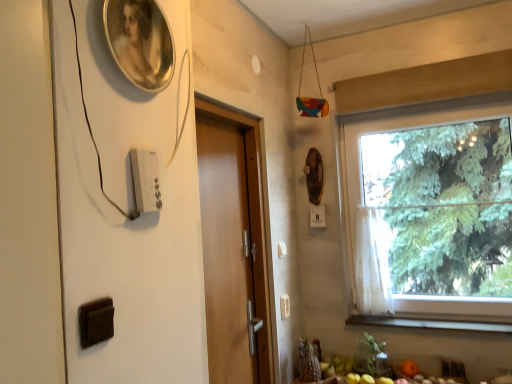
This screenshot has height=384, width=512. Find the location of `wooden door at center`. wooden door at center is located at coordinates (229, 249).

In order to click on white plastic light switch at center, which ranks as the 3th light switch in left-to-right order in this screenshot , I will do `click(317, 216)`.

In order to face white plastic light switch at lower right, arranged as the 2th light switch when viewed from the left, should I rotate leftwards or rightwards?

To align with it, rotate right about 4.062°.

What do you see at coordinates (431, 215) in the screenshot? Image resolution: width=512 pixels, height=384 pixels. I see `transparent glass window at right` at bounding box center [431, 215].

You are a GUI agent. You are given a task and a screenshot of the screen. Output one action in this format:
    pyautogui.click(x=<x>, y=<y>)
    Task: Click on the white plastic light switch at upper left, the first light switch in the front-to-back sequence
    
    Given the screenshot: What is the action you would take?
    pyautogui.click(x=146, y=180)

Identify the location of wooden door at center. The image size is (512, 384). (229, 249).

Considering the positions of points (455, 328) and (155, 198), is point (455, 328) closer to camera compared to point (155, 198)?

No, (455, 328) is further to viewer.

In terms of size, does wooden at lower right appear bigger or smaller than white plastic light switch at upper left, the 1th light switch from the left?

Clearly, wooden at lower right is larger in size than white plastic light switch at upper left, the 1th light switch from the left.

Consider the image. How different are the orientations of wooden at lower right and white plastic light switch at upper left, acting as the third light switch starting from the right, in degrees?

The facing directions of wooden at lower right and white plastic light switch at upper left, acting as the third light switch starting from the right, are 90.8 degrees apart.

Is wooden at lower right looking in the opposite direction of white plastic light switch at upper left, acting as the third light switch starting from the right?

wooden at lower right is not turned away from white plastic light switch at upper left, acting as the third light switch starting from the right.

Who is bigger, white plastic light switch at upper left, acting as the third light switch starting from the back, or white plastic light switch at center, acting as the first light switch starting from the back?

white plastic light switch at center, acting as the first light switch starting from the back.

From a real-world perspective, is white plastic light switch at upper left, the first light switch in the front-to-back sequence, under white plastic light switch at center, acting as the first light switch starting from the back?

Actually, white plastic light switch at upper left, the first light switch in the front-to-back sequence, is physically above white plastic light switch at center, acting as the first light switch starting from the back, in the real world.

Considering the relative positions of white plastic light switch at upper left, the 1th light switch from the left, and white plastic light switch at center, which appears as the second light switch when ordered from the bottom, in the image provided, is white plastic light switch at upper left, the 1th light switch from the left, to the left of white plastic light switch at center, which appears as the second light switch when ordered from the bottom, from the viewer's perspective?

Indeed, white plastic light switch at upper left, the 1th light switch from the left, is positioned on the left side of white plastic light switch at center, which appears as the second light switch when ordered from the bottom.

From the picture: Is white plastic light switch at upper left, positioned as the third light switch in bottom-to-top order, inside the boundaries of white plastic light switch at center, arranged as the 2th light switch when viewed from the top, or outside?

white plastic light switch at upper left, positioned as the third light switch in bottom-to-top order, is located beyond the bounds of white plastic light switch at center, arranged as the 2th light switch when viewed from the top.

In the scene shown: Is white plastic light switch at center, arranged as the 2th light switch when viewed from the top, oriented away from transparent glass window at right?

white plastic light switch at center, arranged as the 2th light switch when viewed from the top, does not have its back to transparent glass window at right.

Based on the photo, from the image's perspective, which is below, white plastic light switch at center, the 3th light switch viewed from the front, or transparent glass window at right?

white plastic light switch at center, the 3th light switch viewed from the front, appears lower in the image.

Does white plastic light switch at center, which appears as the second light switch when ordered from the bottom, contain transparent glass window at right?

That's incorrect, transparent glass window at right is not inside white plastic light switch at center, which appears as the second light switch when ordered from the bottom.

In the scene shown: Who is shorter, white plastic light switch at center, acting as the first light switch starting from the back, or transparent glass window at right?

Standing shorter between the two is white plastic light switch at center, acting as the first light switch starting from the back.

Is point (318, 220) closer or farther from the camera than point (137, 177)?

Point (318, 220).

This screenshot has height=384, width=512. What are the coordinates of `the 1st light switch directly beneath the white plastic light switch at upper left, acting as the third light switch starting from the back (from a real-world perspective)` in the screenshot? It's located at point(317,216).

Looking at this image, is white plastic light switch at center, acting as the first light switch starting from the back, at the left side of white plastic light switch at upper left, the 1th light switch from the left?

Incorrect, white plastic light switch at center, acting as the first light switch starting from the back, is not on the left side of white plastic light switch at upper left, the 1th light switch from the left.

Do you think white plastic light switch at center, the 3th light switch viewed from the front, is within white plastic light switch at upper left, the first light switch in the front-to-back sequence, or outside of it?

white plastic light switch at center, the 3th light switch viewed from the front, lies outside white plastic light switch at upper left, the first light switch in the front-to-back sequence.

Who is more distant, transparent glass window at right or wooden door at center?

Positioned behind is transparent glass window at right.

Is transparent glass window at right oriented towards wooden door at center?

No, transparent glass window at right is not turned towards wooden door at center.

Considering the relative sizes of transparent glass window at right and wooden door at center in the image provided, is transparent glass window at right thinner than wooden door at center?

In fact, transparent glass window at right might be wider than wooden door at center.

From the image's perspective, would you say transparent glass window at right is shown under wooden door at center?

No, from the image's perspective, transparent glass window at right is not beneath wooden door at center.

Considering the points (482, 324) and (458, 262), which point is in front, point (482, 324) or point (458, 262)?

The point (482, 324) is closer.

Is wooden at lower right bigger than transparent glass window at right?

No.

Is wooden at lower right in contact with transparent glass window at right?

There is a gap between wooden at lower right and transparent glass window at right.

Is white plastic light switch at lower right, placed as the second light switch when sorted from front to back, turned away from wooden door at center?

No, white plastic light switch at lower right, placed as the second light switch when sorted from front to back, is not facing away from wooden door at center.

Considering the sizes of white plastic light switch at lower right, placed as the second light switch when sorted from front to back, and wooden door at center in the image, is white plastic light switch at lower right, placed as the second light switch when sorted from front to back, bigger or smaller than wooden door at center?

In the image, white plastic light switch at lower right, placed as the second light switch when sorted from front to back, appears to be smaller than wooden door at center.

Between white plastic light switch at lower right, arranged as the 2th light switch when viewed from the left, and wooden door at center, which one appears on the left side from the viewer's perspective?

wooden door at center.

Looking at this image, from a real-world perspective, is white plastic light switch at lower right, the 1th light switch ordered from the bottom, located beneath wooden door at center?

Correct, in the physical world, white plastic light switch at lower right, the 1th light switch ordered from the bottom, is lower than wooden door at center.

The width and height of the screenshot is (512, 384). I want to click on light switch lying in front of the wooden at lower right, so click(146, 180).

Locate an element on the screen. This screenshot has width=512, height=384. light switch lying above the white plastic light switch at center, acting as the first light switch starting from the back (from the image's perspective) is located at coordinates (146, 180).

Estimate the real-world distances between objects in this image. Which object is closer to transparent glass window at right, wooden door at center or white plastic light switch at lower right, placed as the second light switch when sorted from front to back?

Based on the image, wooden door at center appears to be nearer to transparent glass window at right.

Looking at the image, which one is located closer to white plastic light switch at lower right, the 1th light switch ordered from the bottom, wooden at lower right or white sheer curtain at window?

white sheer curtain at window lies closer to white plastic light switch at lower right, the 1th light switch ordered from the bottom, than the other object.

When comparing their distances from white sheer curtain at window, does transparent glass window at right or white plastic light switch at center, which appears as the 1th light switch when viewed from the right, seem further?

The object further to white sheer curtain at window is transparent glass window at right.

When comparing their distances from transparent glass window at right, does wooden door at center or white sheer curtain at window seem closer?

Based on the image, white sheer curtain at window appears to be nearer to transparent glass window at right.

Based on their spatial positions, is white plastic light switch at lower right, arranged as the 2th light switch when viewed from the left, or wooden door at center further from transparent glass window at right?

white plastic light switch at lower right, arranged as the 2th light switch when viewed from the left, is positioned further to the anchor transparent glass window at right.

Estimate the real-world distances between objects in this image. Which object is closer to wooden at lower right, transparent glass window at right or wooden door at center?

Based on the image, transparent glass window at right appears to be nearer to wooden at lower right.

From the picture: From the image, which object appears to be nearer to wooden at lower right, transparent glass window at right or white plastic light switch at lower right, the 1th light switch ordered from the bottom?

Among the two, white plastic light switch at lower right, the 1th light switch ordered from the bottom, is located nearer to wooden at lower right.

Considering their positions, is white plastic light switch at center, which ranks as the 3th light switch in left-to-right order, positioned closer to white plastic light switch at upper left, acting as the third light switch starting from the back, than transparent glass window at right?

white plastic light switch at center, which ranks as the 3th light switch in left-to-right order.

At what (x,y) coordinates should I click in order to perform the action: click on window sill situated between white plastic light switch at upper left, the 1th light switch from the left, and transparent glass window at right from left to right. Please return your answer as a coordinate pair (x, y). Image resolution: width=512 pixels, height=384 pixels. Looking at the image, I should click on (428, 323).

The width and height of the screenshot is (512, 384). What are the coordinates of `window sill located between white plastic light switch at upper left, positioned as the third light switch in bottom-to-top order, and white plastic light switch at center, acting as the first light switch starting from the back, in the depth direction` in the screenshot? It's located at (428, 323).

Image resolution: width=512 pixels, height=384 pixels. In order to click on light switch between white plastic light switch at lower right, arranged as the third light switch when viewed from the top, and white sheer curtain at window from left to right in this screenshot , I will do `click(317, 216)`.

Identify the location of curtain between wooden door at center and transparent glass window at right. Image resolution: width=512 pixels, height=384 pixels. (372, 263).